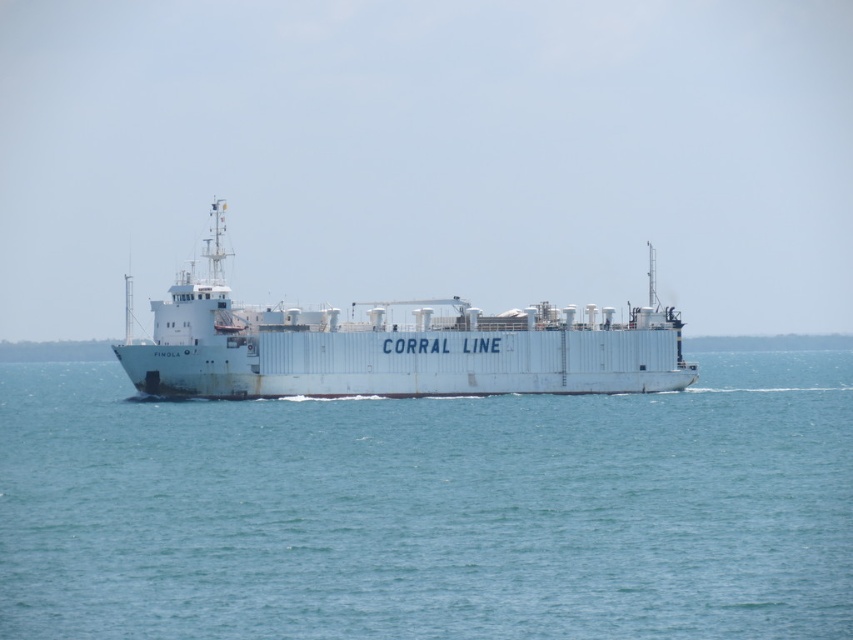
Is point (531, 502) less distant than point (461, 305)?

Yes, point (531, 502) is closer to viewer.

Is blue water at center below white matte ship at center?

Correct, blue water at center is located below white matte ship at center.

Where is `blue water at center`? This screenshot has height=640, width=853. blue water at center is located at coordinates pyautogui.click(x=430, y=509).